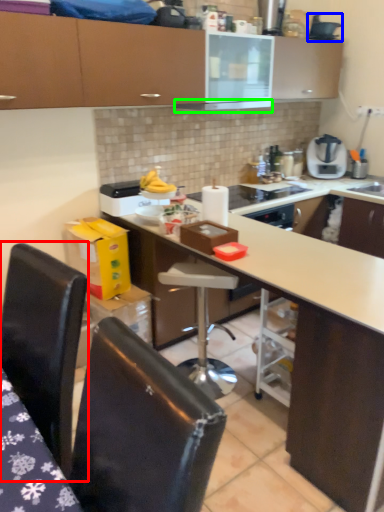
Question: Based on their relative distances, which object is farther from chair (highlighted by a red box)? Choose from appliance (highlighted by a blue box) and exhaust hood (highlighted by a green box).

Choices:
 (A) appliance
 (B) exhaust hood

Answer: (A)